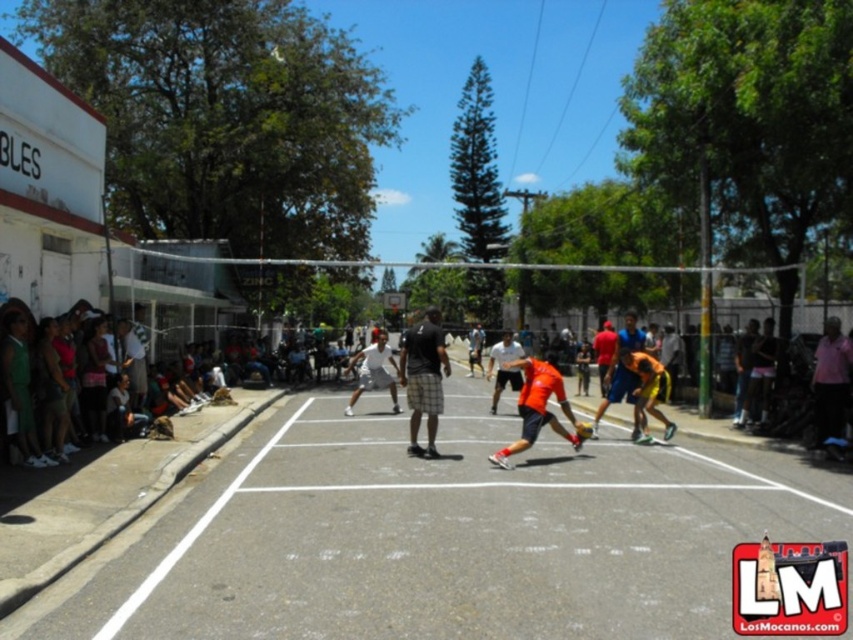
Question: Which object is positioned farthest from the orange fabric shorts at center?

Choices:
 (A) white asphalt court at center
 (B) black cotton shirt at center
 (C) orange fabric shirt at center
 (D) white matte shorts at center

Answer: (D)

Question: Which object appears farthest from the camera in this image?

Choices:
 (A) orange fabric shorts at center
 (B) white asphalt court at center

Answer: (A)

Question: Is orange fabric shorts at center thinner than white matte shorts at center?

Choices:
 (A) no
 (B) yes

Answer: (A)

Question: Estimate the real-world distances between objects in this image. Which object is closer to the orange fabric shirt at center?

Choices:
 (A) white asphalt court at center
 (B) black cotton shirt at center

Answer: (B)

Question: Does white asphalt court at center appear on the right side of orange fabric shorts at center?

Choices:
 (A) yes
 (B) no

Answer: (B)

Question: From the image, what is the correct spatial relationship of white asphalt court at center in relation to orange fabric shirt at center?

Choices:
 (A) left
 (B) right

Answer: (A)